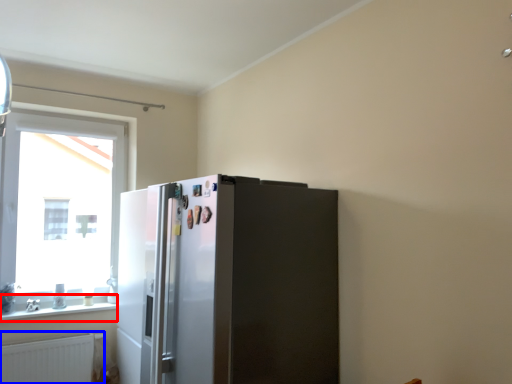
Question: Which object appears closest to the camera in this image, window sill (highlighted by a red box) or radiator (highlighted by a blue box)?

Choices:
 (A) window sill
 (B) radiator

Answer: (B)